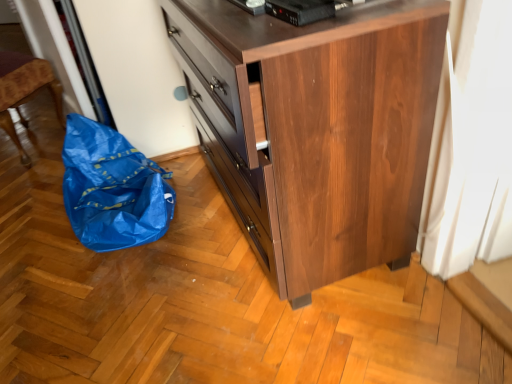
Where is `vacant space in front of brown wood chest of drawers at center`? The image size is (512, 384). vacant space in front of brown wood chest of drawers at center is located at coordinates (294, 326).